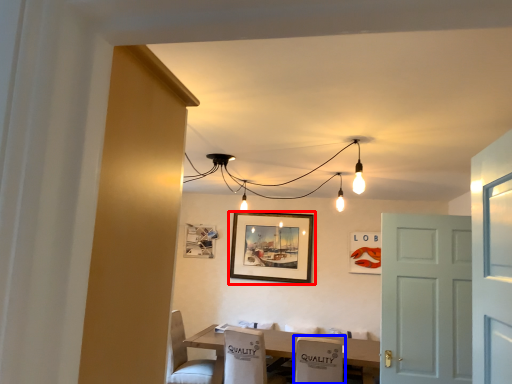
Question: Which object appears closest to the camera in this image, picture frame (highlighted by a red box) or armchair (highlighted by a blue box)?

Choices:
 (A) picture frame
 (B) armchair

Answer: (B)